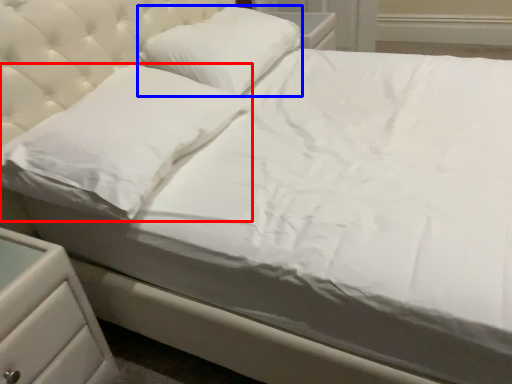
Question: Which point is further to the camera, pillow (highlighted by a red box) or pillow (highlighted by a blue box)?

Choices:
 (A) pillow
 (B) pillow

Answer: (B)